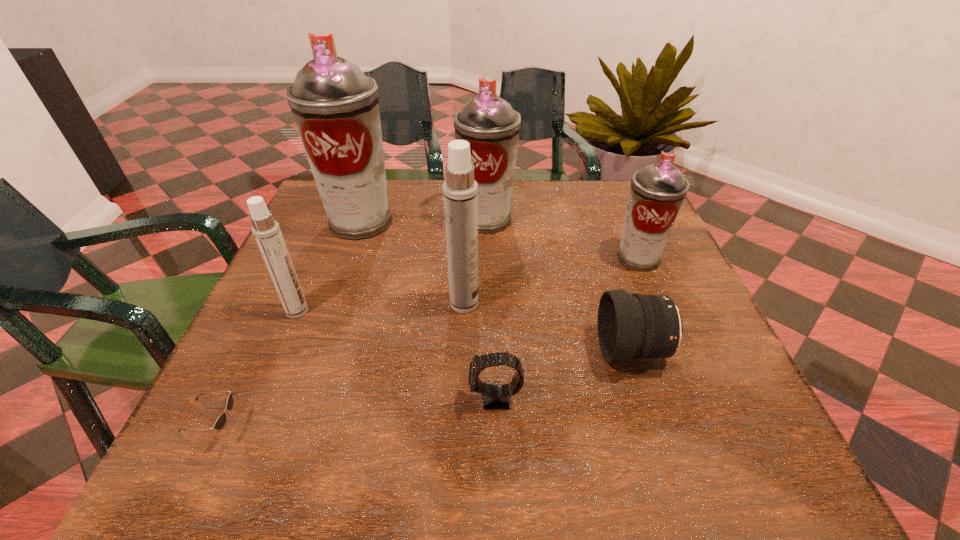
Locate an element on the screen. object that is at the near left corner is located at coordinates (220, 422).

You are a GUI agent. You are given a task and a screenshot of the screen. Output one action in this format:
    pyautogui.click(x=<x>, y=<y>)
    Task: Click on the free spot at the far edge of the desktop
    The width and height of the screenshot is (960, 540).
    Given the screenshot: What is the action you would take?
    pyautogui.click(x=579, y=221)

Where is `free location at the near edge`? The width and height of the screenshot is (960, 540). free location at the near edge is located at coordinates 411,455.

Identify the location of vacant position at the left edge of the desktop. This screenshot has height=540, width=960. (353, 249).

This screenshot has height=540, width=960. Identify the location of vacant space at the right edge of the desktop. (709, 336).

This screenshot has width=960, height=540. What are the coordinates of `free spot at the far right corner of the desktop` in the screenshot? It's located at click(x=598, y=180).

This screenshot has width=960, height=540. Find the location of `vacant space in between the second shortest object and the sunglasses`. vacant space in between the second shortest object and the sunglasses is located at coordinates (357, 414).

Identify the location of empty location between the bigger white aerosol can and the third nearest object. This screenshot has height=540, width=960. (548, 327).

The width and height of the screenshot is (960, 540). What are the coordinates of `free point between the gray watch and the right white aerosol can` in the screenshot? It's located at (480, 352).

The width and height of the screenshot is (960, 540). Find the location of `vacant area between the right white aerosol can and the smallest gray aerosol can`. vacant area between the right white aerosol can and the smallest gray aerosol can is located at coordinates (551, 281).